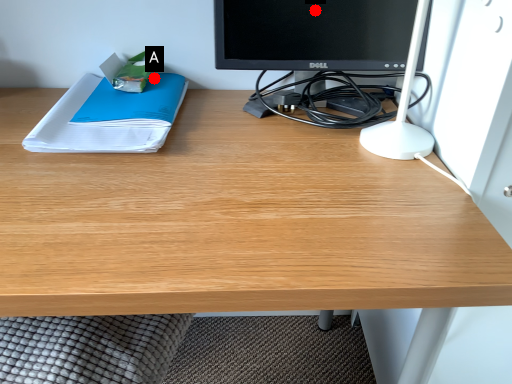
Question: Two points are circled on the image, labeled by A and B beside each circle. Which point is closer to the camera taking this photo?

Choices:
 (A) A is closer
 (B) B is closer

Answer: (B)